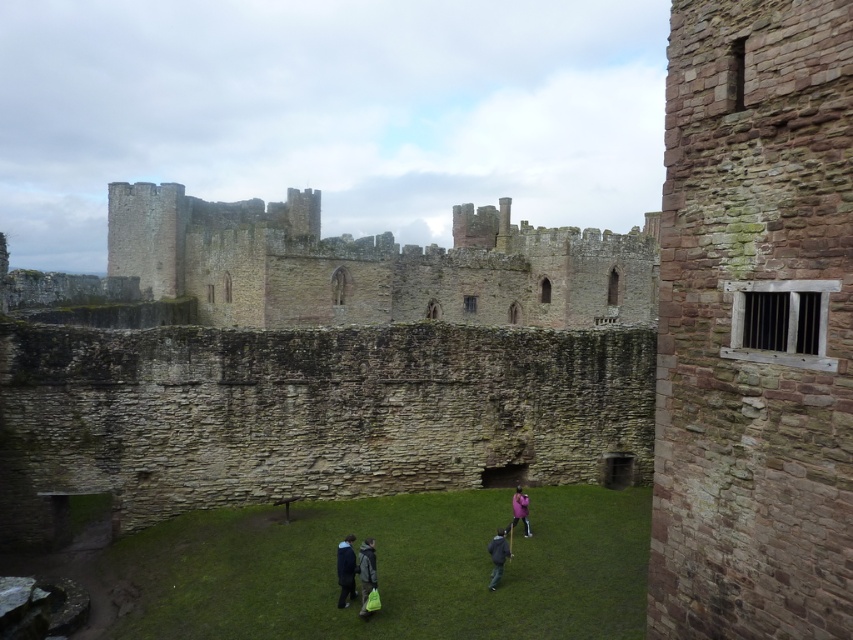
You are standing in the castle courtyard and want to take a photo of both point (x=544, y=280) and point (x=525, y=493). Which point should you position yourself closer to in order to have both points visible in the frame?

You should position yourself closer to point (x=525, y=493) because point (x=544, y=280) is behind it, so being closer to the front point increases the chance of both being in the frame.

You are standing in the medieval castle courtyard and want to place the green fabric bag at center so that it doesn not block the view of the brown stone castle at center. Based on their sizes, is this possible?

The brown stone castle at center is taller than the green fabric bag at center, so placing the green fabric bag at center won t block the view of the castle since it is shorter.

You are a visitor in the castle courtyard and want to place your green fabric bag at center on a bench. The bench is located near the brown stone castle at center. Will the bag fit on the bench?

The brown stone castle at center is larger than the green fabric bag at center, so the bag should fit on the bench near the castle since it is smaller in size.